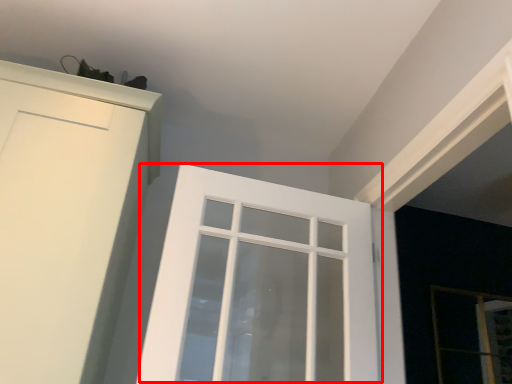
Question: Where is window (annotated by the red box) located in relation to screen door in the image?

Choices:
 (A) left
 (B) right

Answer: (A)